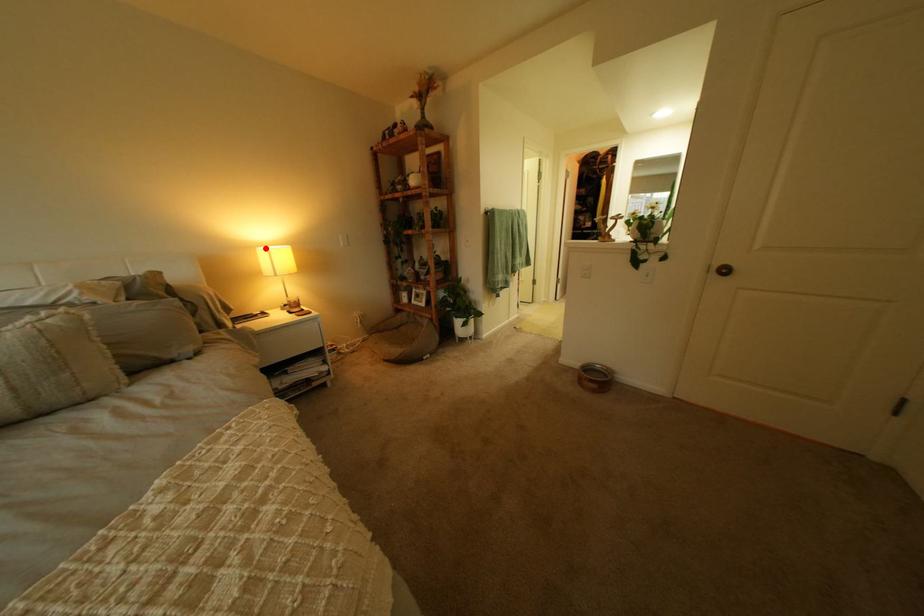
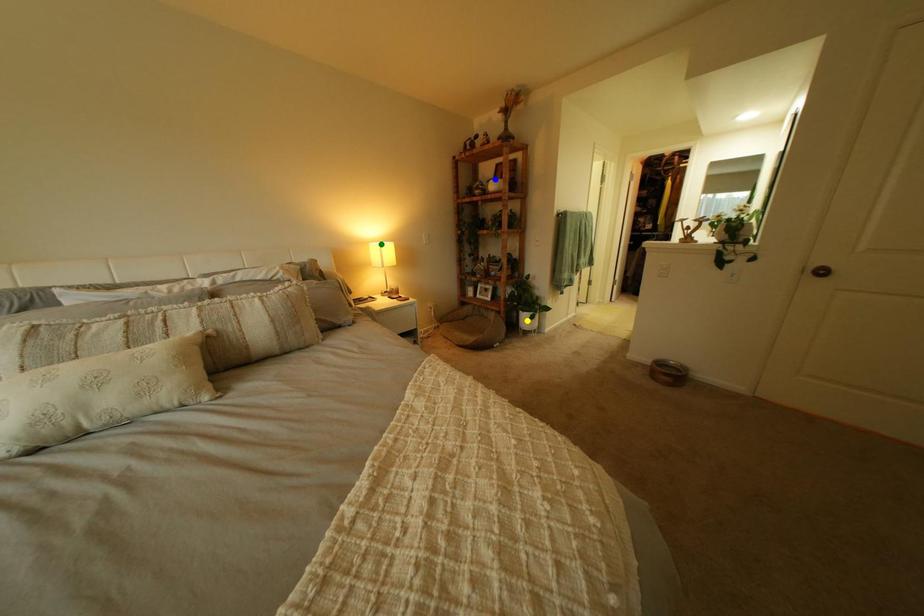
Question: I am providing you with two images of the same scene from different viewpoints. A red point is marked on the first image. You are given multiple points on the second image. In image 2, which mark is for the same physical point as the one in image 1?

Choices:
 (A) yellow point
 (B) green point
 (C) blue point

Answer: (B)